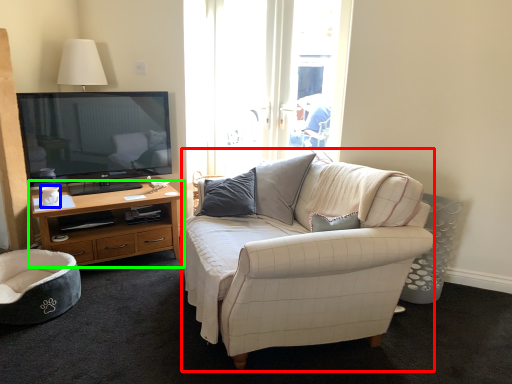
Question: Which is farther away from studio couch (highlighted by a red box)? coffee cup (highlighted by a blue box) or cabinetry (highlighted by a green box)?

Choices:
 (A) coffee cup
 (B) cabinetry

Answer: (A)